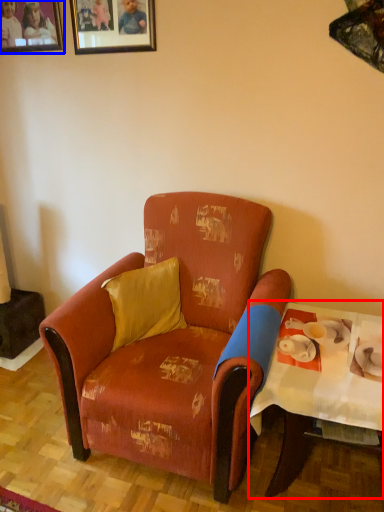
Question: Which object appears farthest to the camera in this image, table (highlighted by a red box) or picture frame (highlighted by a blue box)?

Choices:
 (A) table
 (B) picture frame

Answer: (B)